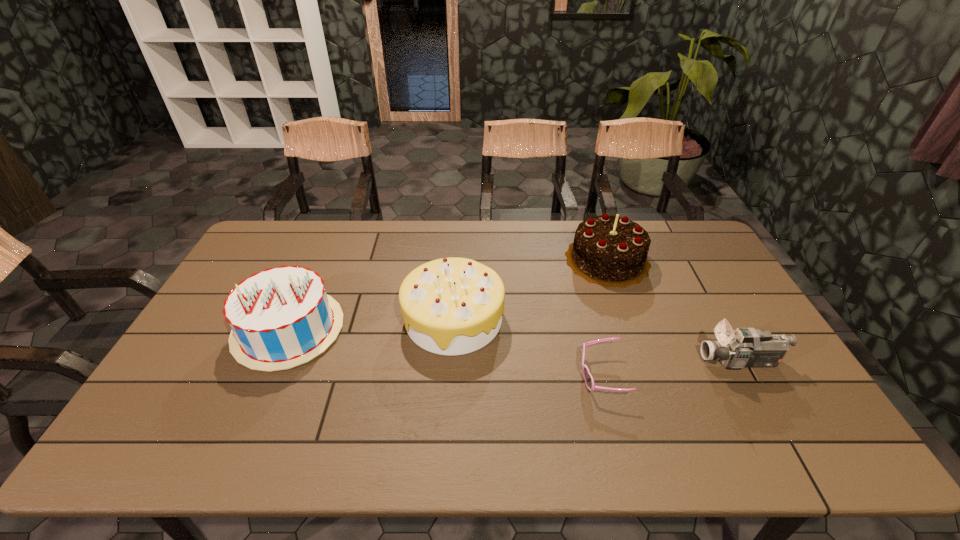
This screenshot has width=960, height=540. I want to click on free location located 0.300m on the front-facing side of the rightmost object, so click(590, 362).

Where is `vacant region located on the front-facing side of the rightmost object`? The height and width of the screenshot is (540, 960). vacant region located on the front-facing side of the rightmost object is located at coordinates (609, 362).

Image resolution: width=960 pixels, height=540 pixels. What are the coordinates of `free space located on the front-facing side of the shortest object` in the screenshot? It's located at (516, 375).

Where is `vacant space located 0.190m on the front-facing side of the shortest object`? Image resolution: width=960 pixels, height=540 pixels. vacant space located 0.190m on the front-facing side of the shortest object is located at coordinates (508, 375).

The width and height of the screenshot is (960, 540). I want to click on vacant region located 0.240m on the front-facing side of the shortest object, so click(489, 375).

Where is `object that is at the far edge`? Image resolution: width=960 pixels, height=540 pixels. object that is at the far edge is located at coordinates (608, 250).

Where is `object present at the left edge`? This screenshot has width=960, height=540. object present at the left edge is located at coordinates (281, 317).

Locate an element on the screen. This screenshot has height=540, width=960. object situated at the right edge is located at coordinates (744, 347).

The image size is (960, 540). What are the coordinates of `blank space at the far edge of the desktop` in the screenshot? It's located at [x=367, y=228].

Locate an element on the screen. The width and height of the screenshot is (960, 540). free space at the near edge of the desktop is located at coordinates (373, 440).